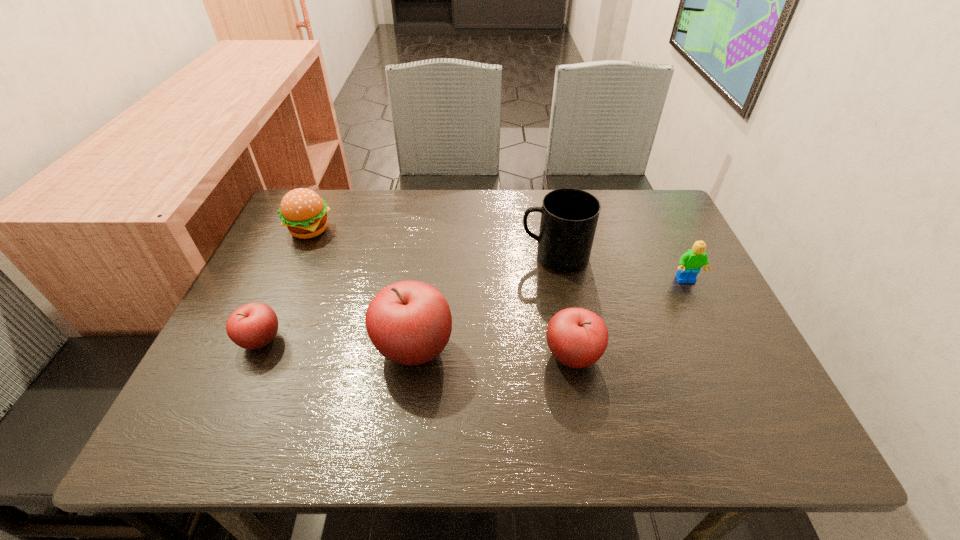
Where is `free point that keeps the apples evenly spaced on the right`? The height and width of the screenshot is (540, 960). free point that keeps the apples evenly spaced on the right is located at coordinates (735, 364).